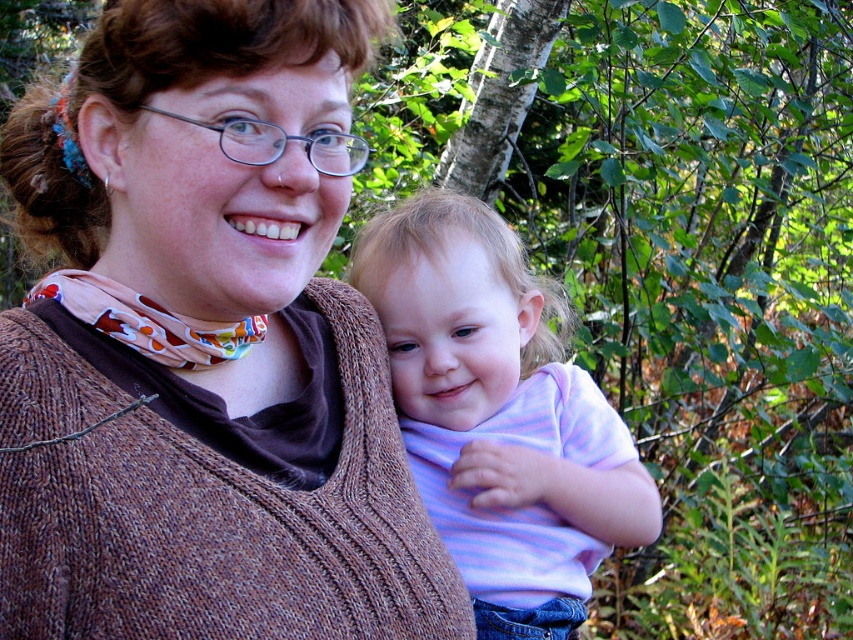
Does brown knitted sweater at center have a lesser height compared to pastel striped shirt at center?

No, brown knitted sweater at center is not shorter than pastel striped shirt at center.

Is brown knitted sweater at center thinner than pastel striped shirt at center?

No, brown knitted sweater at center is not thinner than pastel striped shirt at center.

Describe the element at coordinates (204, 346) in the screenshot. The image size is (853, 640). I see `brown knitted sweater at center` at that location.

Find the location of `brown knitted sweater at center`. brown knitted sweater at center is located at coordinates (204, 346).